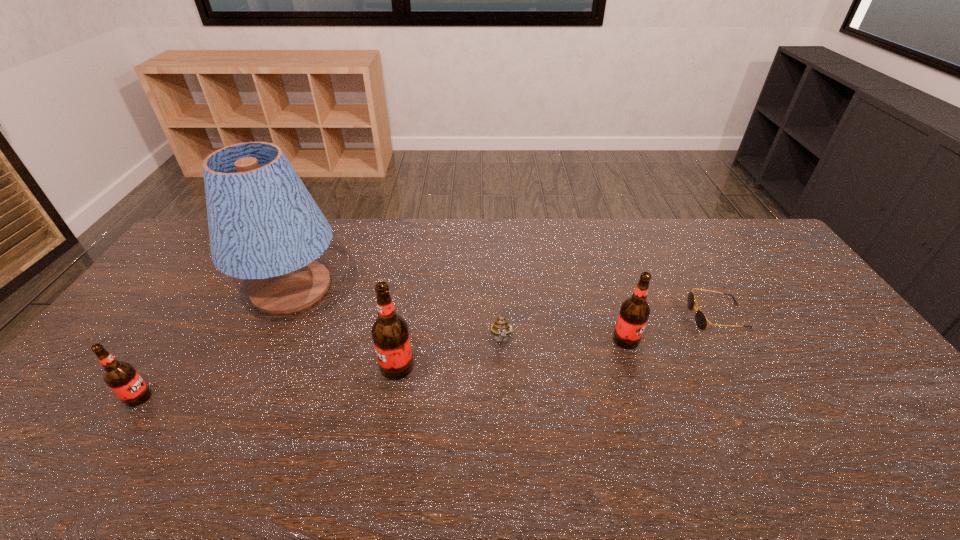
Identify the location of lampshade. This screenshot has height=540, width=960. (264, 225).

Identify the location of the tallest object. (264, 225).

Find the location of a particular element. The width and height of the screenshot is (960, 540). free region located 0.090m on the right of the leftmost root beer is located at coordinates (185, 397).

At what (x,y) coordinates should I click in order to perform the action: click on free space located on the back of the second tallest object. Please return your answer as a coordinate pair (x, y). The image size is (960, 540). Looking at the image, I should click on (413, 275).

Where is `free spot located 0.320m on the back of the fourth shortest object`? This screenshot has width=960, height=540. free spot located 0.320m on the back of the fourth shortest object is located at coordinates (601, 262).

This screenshot has height=540, width=960. Find the location of `free location located 0.200m on the face of the fourth object from left to right`. free location located 0.200m on the face of the fourth object from left to right is located at coordinates (506, 420).

Locate an element on the screen. Image resolution: width=960 pixels, height=540 pixels. vacant space located on the lenses of the sunglasses is located at coordinates (671, 317).

Identify the location of vacant position located on the lenses of the sunglasses. The image size is (960, 540). pyautogui.click(x=616, y=317).

Find the location of a particular element. The height and width of the screenshot is (540, 960). free space located 0.390m on the lenses of the sunglasses is located at coordinates (564, 317).

Locate an element on the screen. The width and height of the screenshot is (960, 540). vacant space located 0.120m on the right of the tallest object is located at coordinates (379, 288).